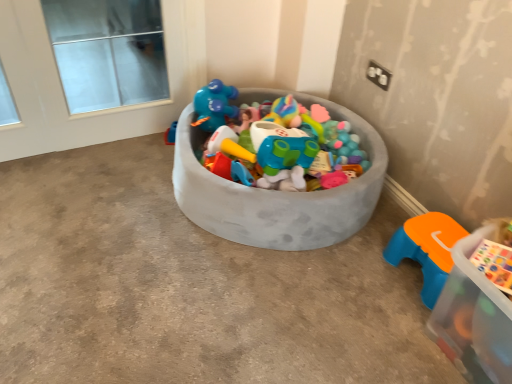
Question: From a real-world perspective, is orange plastic stool at lower right physically below textured gray bowl at center, the first storage box from the left?

Choices:
 (A) yes
 (B) no

Answer: (A)

Question: Is orange plastic stool at lower right turned away from textured gray bowl at center, placed as the first storage box when sorted from back to front?

Choices:
 (A) yes
 (B) no

Answer: (B)

Question: Is orange plastic stool at lower right at the left side of textured gray bowl at center, which appears as the 2th storage box when viewed from the front?

Choices:
 (A) yes
 (B) no

Answer: (B)

Question: From the image's perspective, would you say orange plastic stool at lower right is positioned over textured gray bowl at center, placed as the first storage box when sorted from back to front?

Choices:
 (A) no
 (B) yes

Answer: (A)

Question: Considering the relative sizes of orange plastic stool at lower right and textured gray bowl at center, which appears as the 2th storage box when viewed from the front, in the image provided, is orange plastic stool at lower right wider than textured gray bowl at center, which appears as the 2th storage box when viewed from the front,?

Choices:
 (A) no
 (B) yes

Answer: (A)

Question: Would you say orange plastic stool at lower right is inside or outside transparent plastic storage box at lower right, the 1th storage box positioned from the right?

Choices:
 (A) outside
 (B) inside

Answer: (A)

Question: Looking at their shapes, would you say orange plastic stool at lower right is wider or thinner than transparent plastic storage box at lower right, the 1th storage box positioned from the right?

Choices:
 (A) wide
 (B) thin

Answer: (B)

Question: From a real-world perspective, is orange plastic stool at lower right physically located above or below transparent plastic storage box at lower right, which ranks as the 1th storage box in front-to-back order?

Choices:
 (A) below
 (B) above

Answer: (A)

Question: Is orange plastic stool at lower right in front of or behind transparent plastic storage box at lower right, which ranks as the 1th storage box in front-to-back order, in the image?

Choices:
 (A) behind
 (B) front

Answer: (A)

Question: Is white glass window at upper left in front of or behind orange plastic stool at lower right in the image?

Choices:
 (A) front
 (B) behind

Answer: (B)

Question: Is white glass window at upper left wider or thinner than orange plastic stool at lower right?

Choices:
 (A) thin
 (B) wide

Answer: (A)

Question: Is white glass window at upper left situated inside orange plastic stool at lower right or outside?

Choices:
 (A) outside
 (B) inside

Answer: (A)

Question: Considering the positions of white glass window at upper left and orange plastic stool at lower right in the image, is white glass window at upper left bigger or smaller than orange plastic stool at lower right?

Choices:
 (A) big
 (B) small

Answer: (A)

Question: Does point (153, 52) appear closer or farther from the camera than point (181, 135)?

Choices:
 (A) closer
 (B) farther

Answer: (B)

Question: In terms of height, does white glass window at upper left look taller or shorter compared to textured gray bowl at center, placed as the first storage box when sorted from back to front?

Choices:
 (A) tall
 (B) short

Answer: (A)